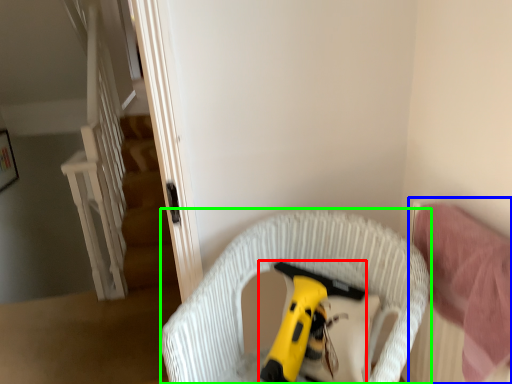
Question: Considering the real-world distances, which object is farthest from toy (highlighted by a red box)? bed (highlighted by a blue box) or furniture (highlighted by a green box)?

Choices:
 (A) bed
 (B) furniture

Answer: (A)